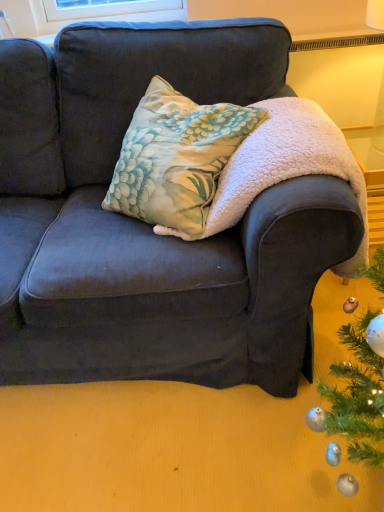
The image size is (384, 512). What do you see at coordinates (176, 157) in the screenshot? I see `floral fabric pillow at center` at bounding box center [176, 157].

At what (x,y) coordinates should I click in order to perform the action: click on floral fabric pillow at center. Please return your answer as a coordinate pair (x, y). The width and height of the screenshot is (384, 512). Looking at the image, I should click on (176, 157).

Where is `floral fabric pillow at center`? The width and height of the screenshot is (384, 512). floral fabric pillow at center is located at coordinates (176, 157).